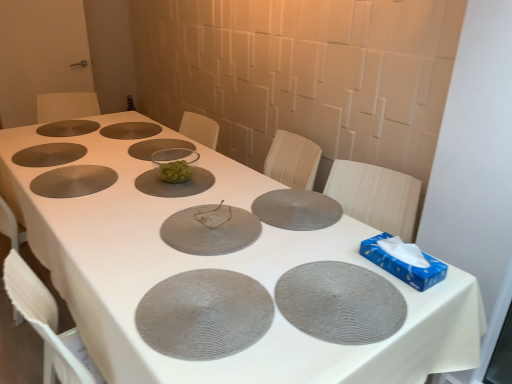
Question: Choose the correct answer: Is gray textured placemat at center, marked as the 1th glass plate in a front-to-back arrangement, inside transparent glass bowl at center, the third glass plate positioned from the back, or outside it?

Choices:
 (A) outside
 (B) inside

Answer: (A)

Question: In terms of height, does gray textured placemat at center, positioned as the 10th glass plate in back-to-front order, look taller or shorter compared to transparent glass bowl at center, the third glass plate positioned from the back?

Choices:
 (A) short
 (B) tall

Answer: (B)

Question: Estimate the real-world distances between objects in this image. Which object is closer to the gray textured placemat at center, positioned as the 10th glass plate in back-to-front order?

Choices:
 (A) matte gray plate at upper left, which is the 7th glass plate in front-to-back order
 (B) matte gray glass plate at upper left, placed as the first glass plate when sorted from back to front
 (C) clear glass bowl at center, marked as the 6th glass plate in a front-to-back arrangement
 (D) matte gray placemat at left, which appears as the fifth glass plate when viewed from the front
 (E) matte gray glass plate at center, placed as the third glass plate when sorted from front to back

Answer: (E)

Question: Which of these objects is positioned closest to the matte gray placemat at center?

Choices:
 (A) matte gray glass plate at center, placed as the third glass plate when sorted from front to back
 (B) green glass bowl at center
 (C) matte gray placemat at left, which appears as the sixth glass plate when viewed from the back
 (D) gray textured placemat at lower right, which ranks as the second glass plate in front-to-back order
 (E) matte brown glass plate at center, which appears as the second glass plate when viewed from the back

Answer: (A)